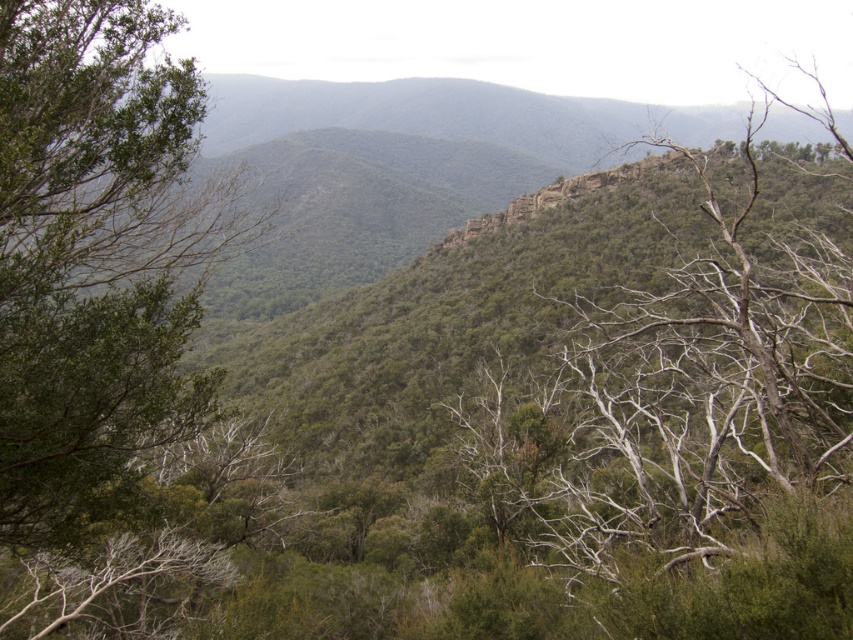
Question: Can you confirm if green leafy tree at left is positioned below green leafy tree at upper right?

Choices:
 (A) no
 (B) yes

Answer: (B)

Question: Which object appears closest to the camera in this image?

Choices:
 (A) green leafy tree at left
 (B) green leafy tree at upper right

Answer: (A)

Question: Does green leafy tree at left have a smaller size compared to green leafy tree at upper right?

Choices:
 (A) yes
 (B) no

Answer: (A)

Question: Among these objects, which one is nearest to the camera?

Choices:
 (A) green leafy tree at upper right
 (B) green leafy tree at left

Answer: (B)

Question: Is green leafy tree at left to the left of green leafy tree at upper right from the viewer's perspective?

Choices:
 (A) yes
 (B) no

Answer: (A)